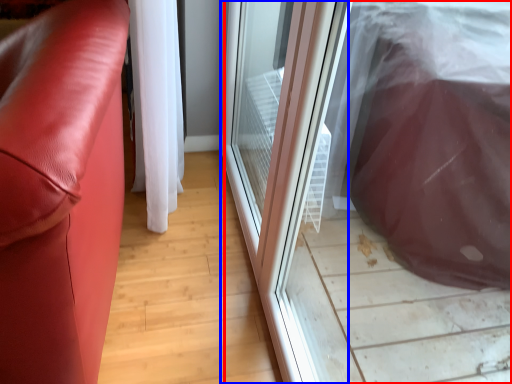
Question: Which of the following is the closest to the observer, screen door (highlighted by a red box) or screen door (highlighted by a blue box)?

Choices:
 (A) screen door
 (B) screen door

Answer: (A)